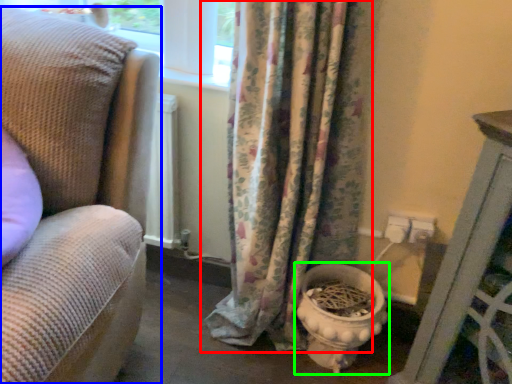
Question: Which is nearer to the curtain (highlighted by a red box)? studio couch (highlighted by a blue box) or toilet bowl (highlighted by a green box).

Choices:
 (A) studio couch
 (B) toilet bowl

Answer: (B)